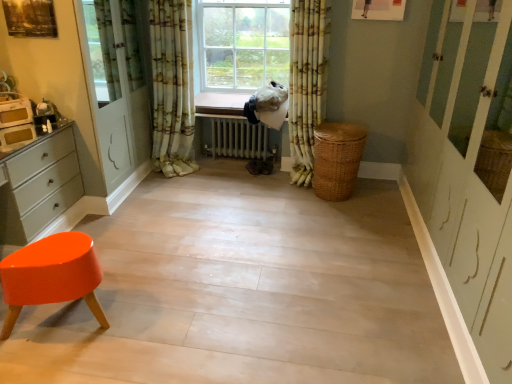
Describe the element at coordinates (172, 87) in the screenshot. This screenshot has height=384, width=512. I see `floral fabric curtain at center, arranged as the 1th curtain when viewed from the left` at that location.

What do you see at coordinates (337, 159) in the screenshot? This screenshot has width=512, height=384. I see `woven brown basket at lower right` at bounding box center [337, 159].

The height and width of the screenshot is (384, 512). What do you see at coordinates (307, 82) in the screenshot?
I see `floral fabric curtain at center, which is the second curtain in left-to-right order` at bounding box center [307, 82].

You are a GUI agent. You are given a task and a screenshot of the screen. Output one action in this format:
    pyautogui.click(x=<x>, y=<y>)
    Task: Click on the matte white chest of drawers at left
    
    Given the screenshot: What is the action you would take?
    tap(41, 186)

What do you see at coordinates (51, 275) in the screenshot?
I see `glossy plastic stool at lower left` at bounding box center [51, 275].

The image size is (512, 384). I want to click on floral fabric curtain at center, placed as the second curtain when sorted from right to left, so click(x=172, y=87).

Is point (166, 96) more distant than point (316, 141)?

Yes, it is.

Does floral fabric curtain at center, placed as the second curtain when sorted from right to left, have a lesser width compared to woven brown basket at lower right?

Yes.

Consider the image. Who is shorter, floral fabric curtain at center, placed as the second curtain when sorted from right to left, or woven brown basket at lower right?

woven brown basket at lower right.

From a real-world perspective, is floral fabric curtain at center, arranged as the 1th curtain when viewed from the left, on top of woven brown basket at lower right?

Yes.

Is matte white toaster at left inside floral fabric curtain at center, placed as the 1th curtain when sorted from right to left?

Actually, matte white toaster at left is outside floral fabric curtain at center, placed as the 1th curtain when sorted from right to left.

You are a GUI agent. You are given a task and a screenshot of the screen. Output one action in this format:
    pyautogui.click(x=<x>, y=<y>)
    Task: Click on the 2nd curtain to the right of the matte white toaster at left, starting your count from the anchor
    
    Given the screenshot: What is the action you would take?
    pyautogui.click(x=307, y=82)

Which of these two, floral fabric curtain at center, which is the second curtain in left-to-right order, or matte white toaster at left, is thinner?

matte white toaster at left.

Does glossy plastic stool at lower left have a lesser height compared to matte white chest of drawers at left?

Correct, glossy plastic stool at lower left is not as tall as matte white chest of drawers at left.

Is glossy plastic stool at lower left next to matte white chest of drawers at left and touching it?

No, glossy plastic stool at lower left is not making contact with matte white chest of drawers at left.

Considering the relative positions of glossy plastic stool at lower left and matte white chest of drawers at left in the image provided, is glossy plastic stool at lower left to the right of matte white chest of drawers at left from the viewer's perspective?

Correct, you'll find glossy plastic stool at lower left to the right of matte white chest of drawers at left.

From the picture: Is glossy plastic stool at lower left facing away from matte white chest of drawers at left?

No, glossy plastic stool at lower left is not facing away from matte white chest of drawers at left.

Find the location of a particular element. The width and height of the screenshot is (512, 384). appliance located on the left of woven brown basket at lower right is located at coordinates (16, 124).

Looking at this image, does woven brown basket at lower right have a lesser width compared to matte white toaster at left?

No.

Is woven brown basket at lower right smaller than matte white toaster at left?

Incorrect, woven brown basket at lower right is not smaller in size than matte white toaster at left.

From a real-world perspective, is woven brown basket at lower right positioned above or below matte white toaster at left?

In terms of real-world spatial position, woven brown basket at lower right is below matte white toaster at left.

From a real-world perspective, is floral fabric curtain at center, placed as the second curtain when sorted from right to left, physically located above or below glossy plastic stool at lower left?

floral fabric curtain at center, placed as the second curtain when sorted from right to left, is above glossy plastic stool at lower left.

Is floral fabric curtain at center, placed as the second curtain when sorted from right to left, looking in the opposite direction of glossy plastic stool at lower left?

No, glossy plastic stool at lower left is not at the back of floral fabric curtain at center, placed as the second curtain when sorted from right to left.

Based on their sizes in the image, would you say floral fabric curtain at center, placed as the second curtain when sorted from right to left, is bigger or smaller than glossy plastic stool at lower left?

In the image, floral fabric curtain at center, placed as the second curtain when sorted from right to left, appears to be larger than glossy plastic stool at lower left.

Is floral fabric curtain at center, arranged as the 1th curtain when viewed from the left, with glossy plastic stool at lower left?

There is a gap between floral fabric curtain at center, arranged as the 1th curtain when viewed from the left, and glossy plastic stool at lower left.

Considering the positions of point (293, 48) and point (329, 155), is point (293, 48) closer or farther from the camera than point (329, 155)?

Clearly, point (293, 48) is more distant from the camera than point (329, 155).

How different are the orientations of floral fabric curtain at center, which is the second curtain in left-to-right order, and woven brown basket at lower right in degrees?

0.42 degrees.

Considering the relative sizes of floral fabric curtain at center, which is the second curtain in left-to-right order, and woven brown basket at lower right in the image provided, is floral fabric curtain at center, which is the second curtain in left-to-right order, smaller than woven brown basket at lower right?

No.

Is woven brown basket at lower right a part of floral fabric curtain at center, placed as the 1th curtain when sorted from right to left?

That's incorrect, woven brown basket at lower right is not inside floral fabric curtain at center, placed as the 1th curtain when sorted from right to left.

From the image's perspective, is matte white chest of drawers at left beneath woven brown basket at lower right?

Indeed, from the image's perspective, matte white chest of drawers at left is shown beneath woven brown basket at lower right.

Which is in front, matte white chest of drawers at left or woven brown basket at lower right?

Positioned in front is matte white chest of drawers at left.

From the picture: Is woven brown basket at lower right at the back of matte white chest of drawers at left?

matte white chest of drawers at left does not have its back to woven brown basket at lower right.

Between matte white chest of drawers at left and woven brown basket at lower right, which one has smaller width?

Thinner between the two is matte white chest of drawers at left.

Where is `basket that is on the right side of floral fabric curtain at center, arranged as the 1th curtain when viewed from the left`? basket that is on the right side of floral fabric curtain at center, arranged as the 1th curtain when viewed from the left is located at coordinates (337, 159).

Identify the location of the 1st curtain behind when counting from the matte white toaster at left. This screenshot has height=384, width=512. (307, 82).

Estimate the real-world distances between objects in this image. Which object is closer to glossy plastic stool at lower left, woven brown basket at lower right or white metallic radiator at center?

Based on the image, woven brown basket at lower right appears to be nearer to glossy plastic stool at lower left.

Considering their positions, is matte white chest of drawers at left positioned further to matte white toaster at left than floral fabric curtain at center, placed as the second curtain when sorted from right to left?

Among the two, floral fabric curtain at center, placed as the second curtain when sorted from right to left, is located further to matte white toaster at left.

Estimate the real-world distances between objects in this image. Which object is closer to glossy plastic stool at lower left, floral fabric curtain at center, placed as the 1th curtain when sorted from right to left, or white metallic radiator at center?

floral fabric curtain at center, placed as the 1th curtain when sorted from right to left.

Looking at the image, which one is located closer to matte white toaster at left, woven brown basket at lower right or floral fabric curtain at center, which is the second curtain in left-to-right order?

Based on the image, floral fabric curtain at center, which is the second curtain in left-to-right order, appears to be nearer to matte white toaster at left.

Looking at the image, which one is located further to matte white toaster at left, floral fabric curtain at center, placed as the 1th curtain when sorted from right to left, or floral fabric curtain at center, arranged as the 1th curtain when viewed from the left?

Based on the image, floral fabric curtain at center, placed as the 1th curtain when sorted from right to left, appears to be further to matte white toaster at left.

Based on their spatial positions, is floral fabric curtain at center, which is the second curtain in left-to-right order, or matte white toaster at left closer to floral fabric curtain at center, placed as the second curtain when sorted from right to left?

Among the two, floral fabric curtain at center, which is the second curtain in left-to-right order, is located nearer to floral fabric curtain at center, placed as the second curtain when sorted from right to left.

Estimate the real-world distances between objects in this image. Which object is further from white metallic radiator at center, matte white chest of drawers at left or floral fabric curtain at center, placed as the second curtain when sorted from right to left?

matte white chest of drawers at left is positioned further to the anchor white metallic radiator at center.

Considering their positions, is floral fabric curtain at center, placed as the second curtain when sorted from right to left, positioned further to floral fabric curtain at center, which is the second curtain in left-to-right order, than glossy plastic stool at lower left?

glossy plastic stool at lower left is positioned further to the anchor floral fabric curtain at center, which is the second curtain in left-to-right order.

Where is `curtain between floral fabric curtain at center, arranged as the 1th curtain when viewed from the left, and woven brown basket at lower right from left to right`? curtain between floral fabric curtain at center, arranged as the 1th curtain when viewed from the left, and woven brown basket at lower right from left to right is located at coordinates (307, 82).

Image resolution: width=512 pixels, height=384 pixels. Identify the location of chest of drawers between glossy plastic stool at lower left and white metallic radiator at center along the z-axis. (41, 186).

Find the location of `curtain situated between matte white toaster at left and floral fabric curtain at center, which is the second curtain in left-to-right order, from left to right`. curtain situated between matte white toaster at left and floral fabric curtain at center, which is the second curtain in left-to-right order, from left to right is located at coordinates (172, 87).

Image resolution: width=512 pixels, height=384 pixels. I want to click on stool between matte white toaster at left and floral fabric curtain at center, placed as the 1th curtain when sorted from right to left, from left to right, so [x=51, y=275].